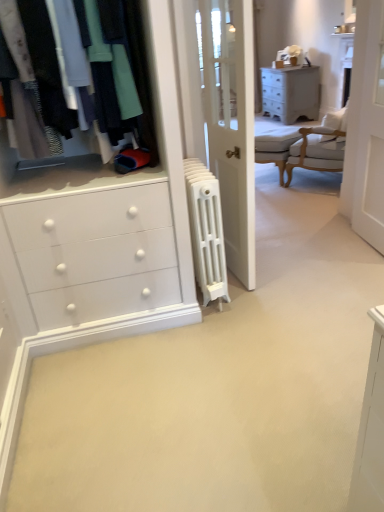
Where is `free space in front of white cast iron radiator at center`? The image size is (384, 512). free space in front of white cast iron radiator at center is located at coordinates (216, 333).